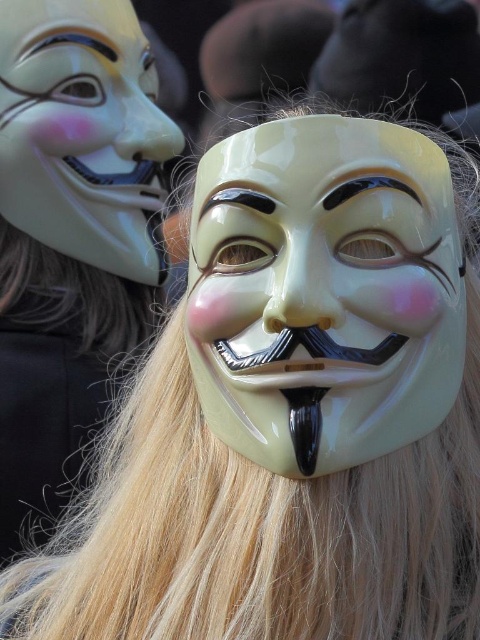
Question: Which point is closer to the camera taking this photo?

Choices:
 (A) (155, 211)
 (B) (265, 301)

Answer: (B)

Question: Does glossy plastic mask at center appear on the left side of matte white mask at upper center?

Choices:
 (A) yes
 (B) no

Answer: (B)

Question: Is glossy plastic mask at center positioned behind matte white mask at upper center?

Choices:
 (A) no
 (B) yes

Answer: (A)

Question: Which object appears farthest from the camera in this image?

Choices:
 (A) matte white mask at upper center
 (B) glossy plastic mask at center

Answer: (A)

Question: Is glossy plastic mask at center bigger than matte white mask at upper center?

Choices:
 (A) yes
 (B) no

Answer: (A)

Question: Which point is farther to the camera?

Choices:
 (A) glossy plastic mask at center
 (B) matte white mask at upper center

Answer: (B)